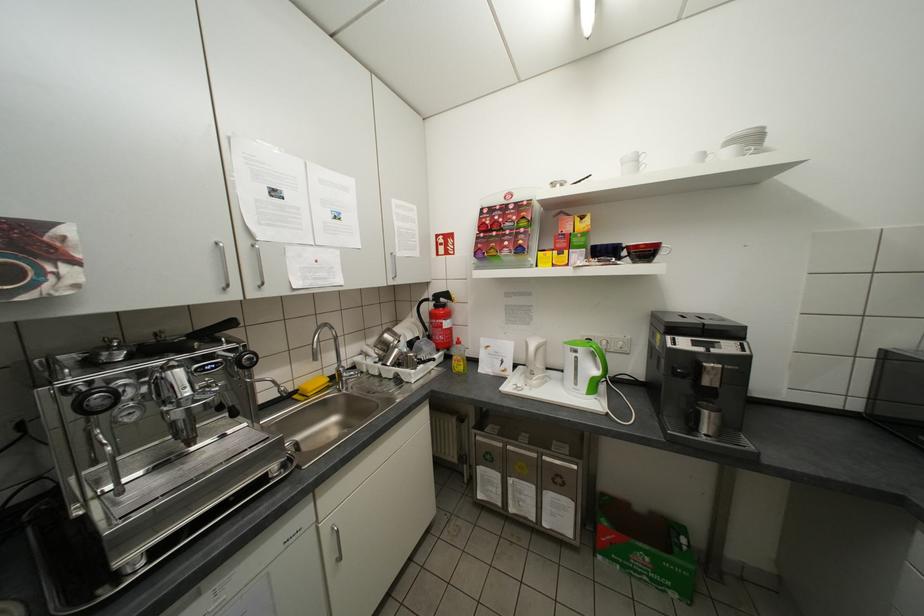
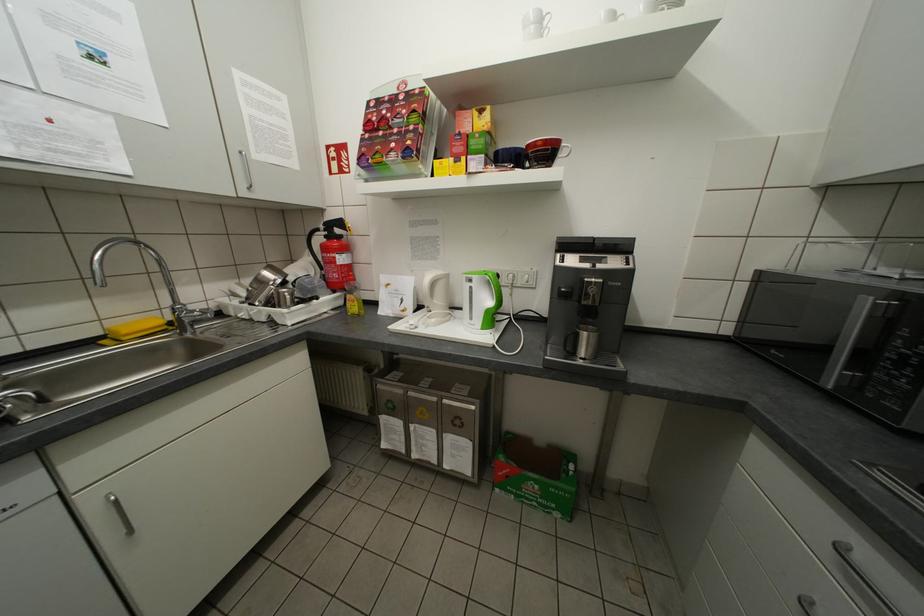
Where in the second image is the point corresponding to the point at 623,259 from the first image?

(521, 166)